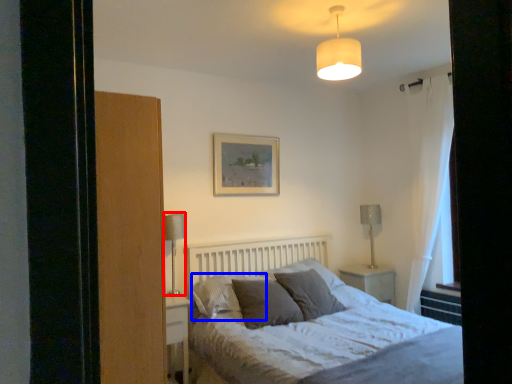
Question: Which object appears farthest to the camera in this image, table lamp (highlighted by a red box) or pillow (highlighted by a blue box)?

Choices:
 (A) table lamp
 (B) pillow

Answer: (A)